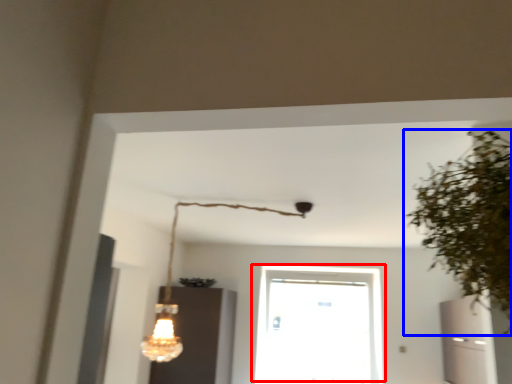
Question: Among these objects, which one is nearest to the camera, window (highlighted by a red box) or houseplant (highlighted by a blue box)?

Choices:
 (A) window
 (B) houseplant

Answer: (B)